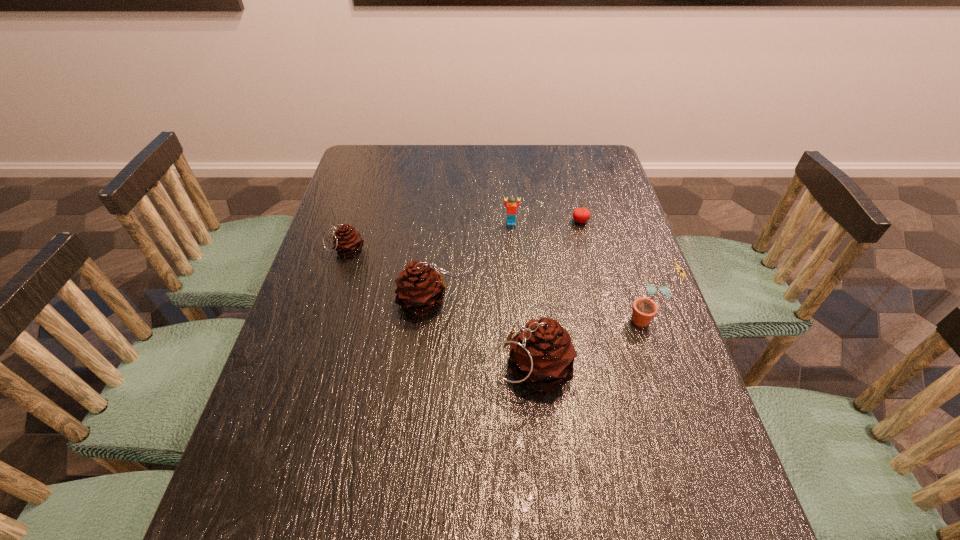
At what (x,y) coordinates should I click in order to perform the action: click on vacant region located with a leaf charm attached to the nearest pinecone. Please return your answer as a coordinate pair (x, y). Looking at the image, I should click on (381, 368).

Locate an element on the screen. This screenshot has width=960, height=540. vacant area situated with a leaf charm attached to the nearest pinecone is located at coordinates (368, 368).

Where is `free point located with a leaf charm attached to the nearest pinecone`? The image size is (960, 540). free point located with a leaf charm attached to the nearest pinecone is located at coordinates (445, 368).

The height and width of the screenshot is (540, 960). I want to click on vacant space located 0.200m on the back of the fifth object from left to right, so click(570, 178).

Identify the location of vacant space located on the face of the Lego. (515, 271).

This screenshot has height=540, width=960. Identify the location of vacant space located on the flower of the sunflower. (553, 320).

This screenshot has width=960, height=540. Find the location of `vacant region located on the flower of the sunflower`. vacant region located on the flower of the sunflower is located at coordinates (595, 320).

This screenshot has height=540, width=960. What are the coordinates of `free space located on the flower of the sunflower` in the screenshot? It's located at (557, 320).

At what (x,y) coordinates should I click in order to perform the action: click on object situated at the left edge. Please return your answer as a coordinate pair (x, y). The height and width of the screenshot is (540, 960). Looking at the image, I should click on (347, 241).

At what (x,y) coordinates should I click in order to perform the action: click on cherry that is at the right edge. Please return your answer as a coordinate pair (x, y). The height and width of the screenshot is (540, 960). Looking at the image, I should click on (581, 215).